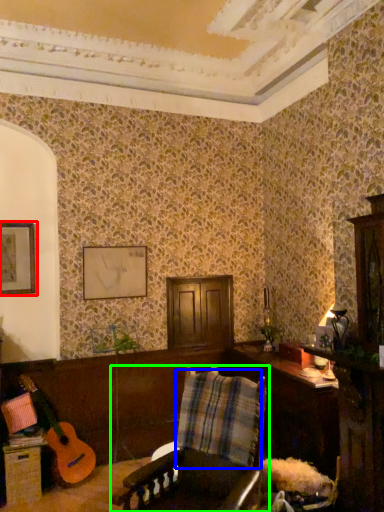
Question: Considering the real-world distances, which object is farthest from picture frame (highlighted by a red box)? plaid (highlighted by a blue box) or chair (highlighted by a green box)?

Choices:
 (A) plaid
 (B) chair

Answer: (B)